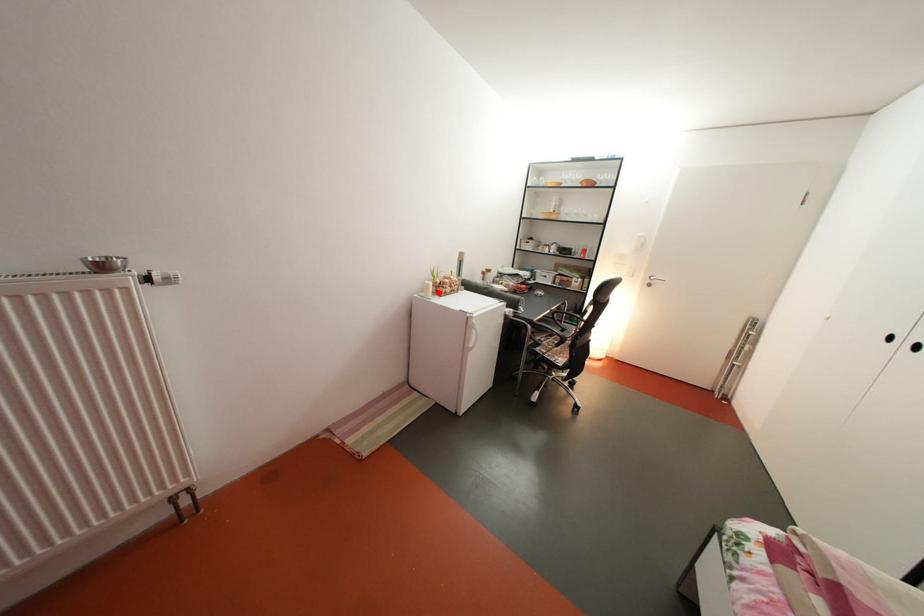
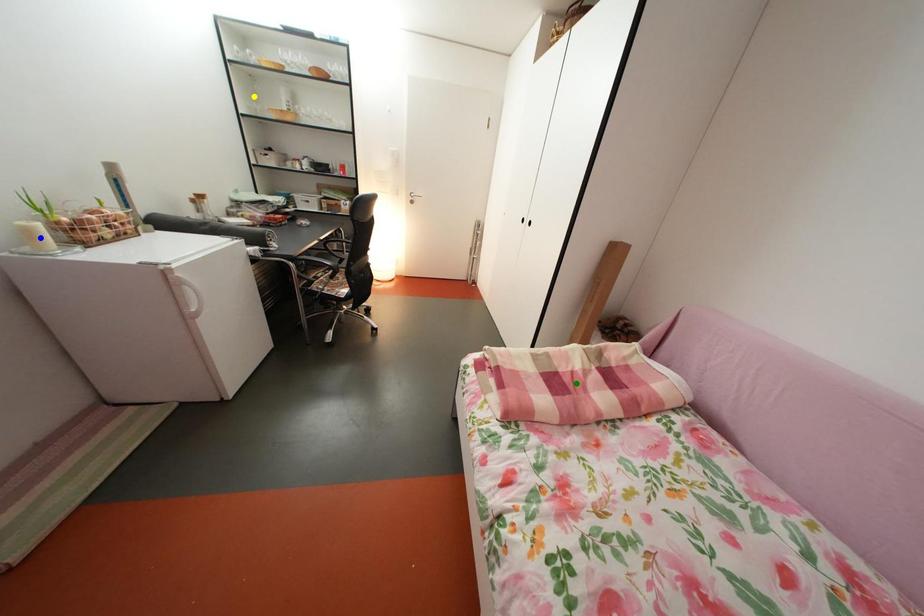
Question: I am providing you with two images of the same scene from different viewpoints. A red point is marked on the first image. You are given multiple points on the second image. Which point in image 2 represents the same 3d spot as the red point in image 1?

Choices:
 (A) blue point
 (B) green point
 (C) yellow point

Answer: (A)